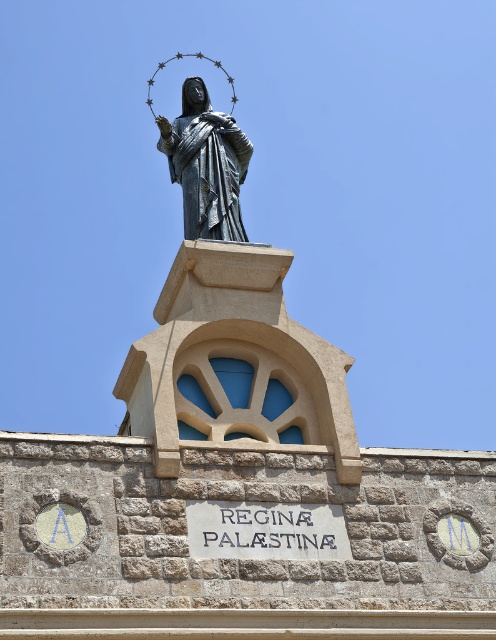
Question: Which of the following is the farthest from the observer?

Choices:
 (A) polished bronze statue at center
 (B) white stone sign at center

Answer: (A)

Question: Can you confirm if polished bronze statue at center is smaller than white stone sign at center?

Choices:
 (A) yes
 (B) no

Answer: (B)

Question: From the image, what is the correct spatial relationship of polished bronze statue at center in relation to white stone sign at center?

Choices:
 (A) below
 (B) above

Answer: (B)

Question: Does polished bronze statue at center come behind white stone sign at center?

Choices:
 (A) no
 (B) yes

Answer: (B)

Question: Which point appears farthest from the camera in this image?

Choices:
 (A) (218, 524)
 (B) (218, 237)

Answer: (B)